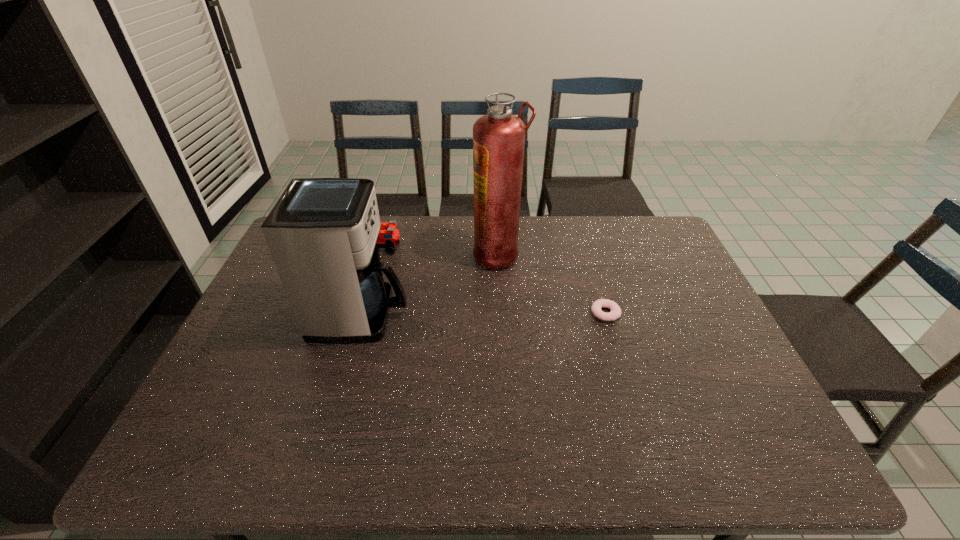
At what (x,y) coordinates should I click in order to perform the action: click on object that stands as the closest to the third tallest object. Please return your answer as a coordinate pair (x, y). The image size is (960, 540). Looking at the image, I should click on (322, 233).

You are a GUI agent. You are given a task and a screenshot of the screen. Output one action in this format:
    pyautogui.click(x=<x>, y=<y>)
    Task: Click on the free space that satisfies the following two spatial constraints: 1. on the front-facing side of the second shortest object; 2. on the right side of the shortest object
    
    Given the screenshot: What is the action you would take?
    pyautogui.click(x=369, y=313)

The width and height of the screenshot is (960, 540). Identify the location of vacant space that satisfies the following two spatial constraints: 1. on the front-facing side of the Lego; 2. on the left side of the rightmost object. (369, 313).

At what (x,y) coordinates should I click in order to perform the action: click on vacant space that satisfies the following two spatial constraints: 1. on the front-facing side of the Lego; 2. on the back side of the rightmost object. Please return your answer as a coordinate pair (x, y). Looking at the image, I should click on (369, 313).

Identify the location of vacant space that satisfies the following two spatial constraints: 1. on the side of the third object from left to right with the label; 2. on the back side of the shortest object. This screenshot has height=540, width=960. (501, 313).

Where is `blank space that satisfies the following two spatial constraints: 1. on the back side of the rightmost object; 2. on the side of the tallest object with the label`? This screenshot has width=960, height=540. blank space that satisfies the following two spatial constraints: 1. on the back side of the rightmost object; 2. on the side of the tallest object with the label is located at coordinates [588, 255].